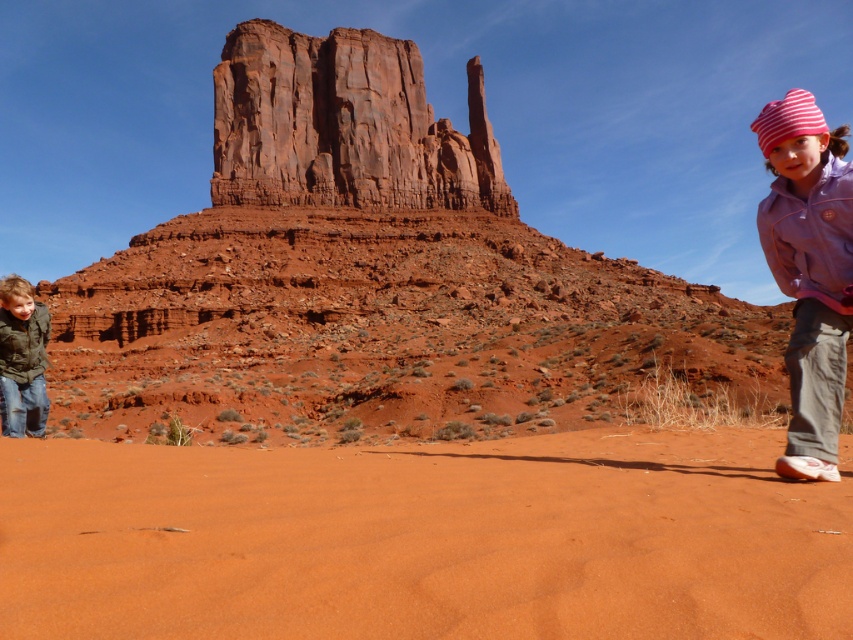
You are a photographer trying to capture the rustic sandstone butte at center and the purple fleece jacket at right in a single shot. Since the jacket is behind the butte, will it be visible in the photo?

The purple fleece jacket at right is behind the rustic sandstone butte at center, so it will not be visible in the photo.

From the picture: Please look at the image and locate the pink striped knit hat at upper right. What are its coordinates in the image?

The pink striped knit hat at upper right is located at coordinates point (x=809, y=269).